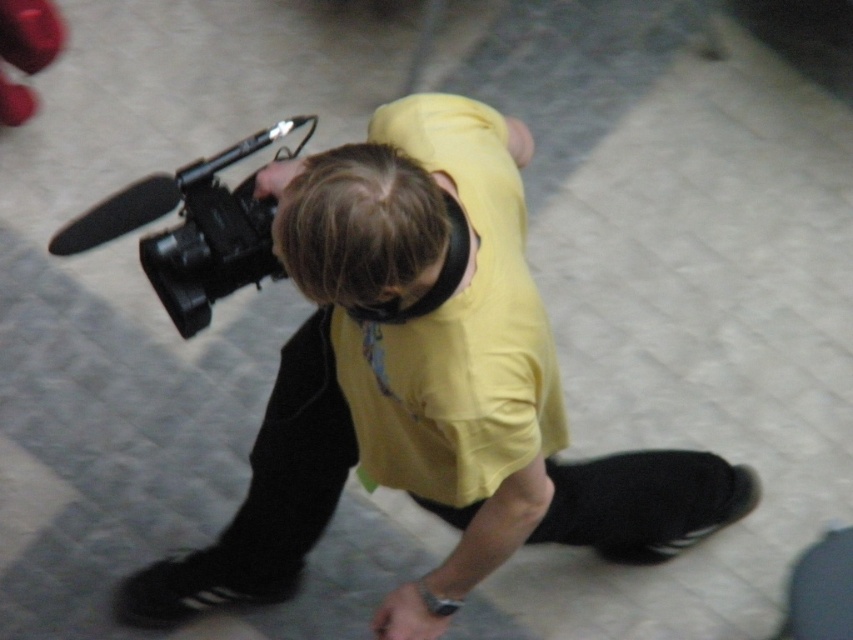
Question: Does black matte camera at center have a smaller size compared to black matte video camera at center?

Choices:
 (A) yes
 (B) no

Answer: (B)

Question: In this image, where is black matte camera at center located relative to black matte video camera at center?

Choices:
 (A) below
 (B) above

Answer: (A)

Question: Which of the following is the closest to the observer?

Choices:
 (A) black matte camera at center
 (B) black matte video camera at center

Answer: (A)

Question: Among these objects, which one is farthest from the camera?

Choices:
 (A) black matte camera at center
 (B) black matte video camera at center

Answer: (B)

Question: Which point is farther to the camera?

Choices:
 (A) black matte video camera at center
 (B) black matte camera at center

Answer: (A)

Question: Is black matte camera at center above black matte video camera at center?

Choices:
 (A) no
 (B) yes

Answer: (A)